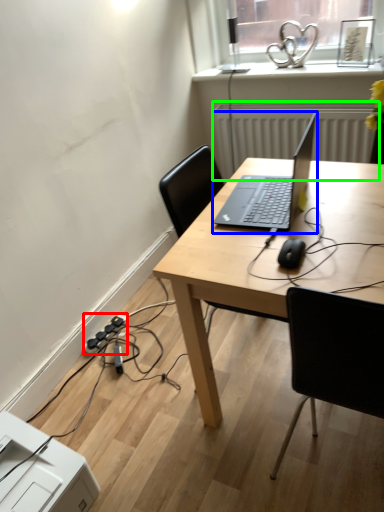
Question: Based on their relative distances, which object is nearer to extension cord (highlighted by a red box)? Choose from laptop (highlighted by a blue box) and radiator (highlighted by a green box).

Choices:
 (A) laptop
 (B) radiator

Answer: (A)